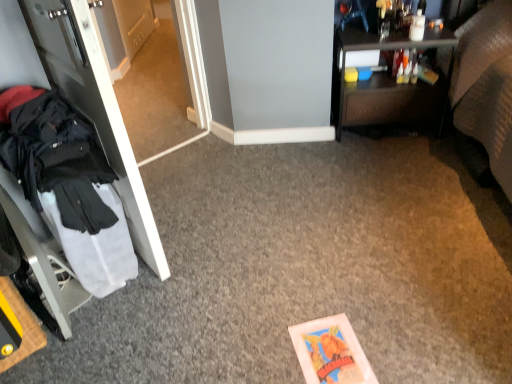
I want to click on free space on the front side of white glossy door at left, so (147, 331).